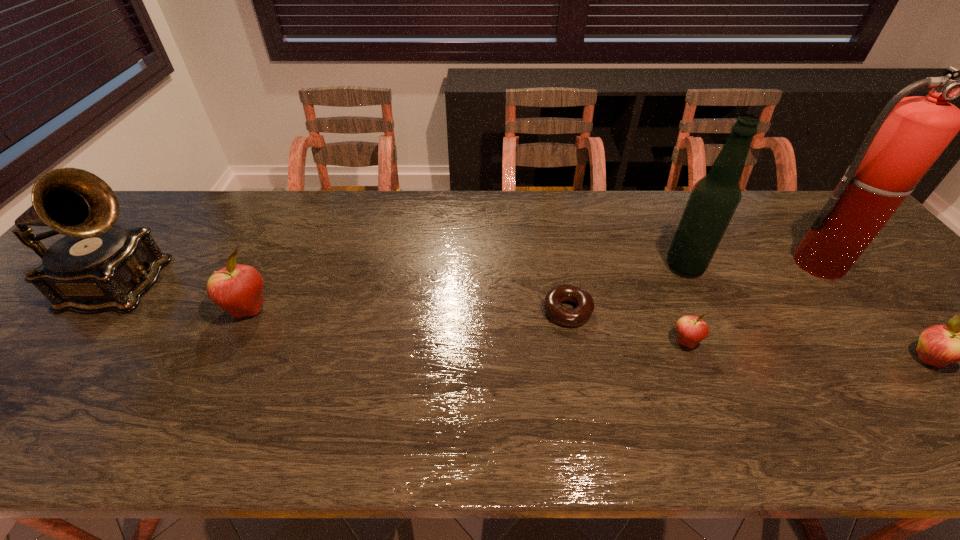
The width and height of the screenshot is (960, 540). I want to click on free location at the right edge of the desktop, so click(868, 299).

I want to click on empty space between the alcohol and the phonograph record, so click(x=400, y=276).

The height and width of the screenshot is (540, 960). What are the coordinates of `free space between the fourth tallest object and the second apple from left to right` in the screenshot? It's located at (467, 326).

The width and height of the screenshot is (960, 540). In order to click on vacant region between the tallest object and the farthest apple in this screenshot , I will do `click(535, 286)`.

The width and height of the screenshot is (960, 540). I want to click on vacant space that is in between the leftmost object and the fire extinguisher, so click(469, 274).

You are a GUI agent. You are given a task and a screenshot of the screen. Output one action in this format:
    pyautogui.click(x=<x>, y=<y>)
    Task: Click on the vacant area that lies between the fourth tallest object and the alcohol
    
    Given the screenshot: What is the action you would take?
    pyautogui.click(x=467, y=288)

Find the location of `empty space that is in between the fire extinguisher and the fourth shortest object`. empty space that is in between the fire extinguisher and the fourth shortest object is located at coordinates (535, 286).

At what (x,y) coordinates should I click in order to perform the action: click on free point between the fire extinguisher and the leftmost apple. Please return your answer as a coordinate pair (x, y). This screenshot has height=540, width=960. Looking at the image, I should click on (535, 286).

Locate an element on the screen. Image resolution: width=960 pixels, height=540 pixels. free spot between the alcohol and the sixth tallest object is located at coordinates (685, 304).

Where is `free space that is in between the second apple from right to left and the third tallest object`? free space that is in between the second apple from right to left and the third tallest object is located at coordinates (401, 314).